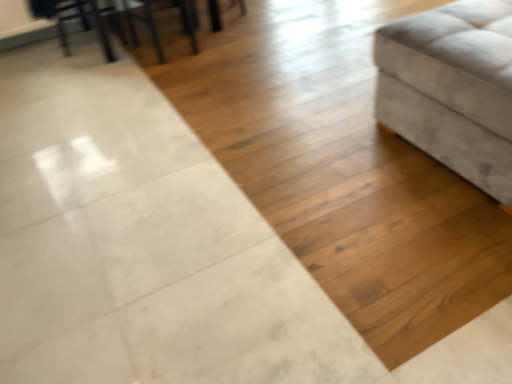
The image size is (512, 384). Describe the element at coordinates (452, 88) in the screenshot. I see `suede-like beige ottoman at right` at that location.

This screenshot has height=384, width=512. Find the location of `suede-like beige ottoman at right`. suede-like beige ottoman at right is located at coordinates (452, 88).

Can you tell me how much suede-like beige ottoman at right and wooden table at upper left differ in facing direction?

There is a 178-degree angle between the facing directions of suede-like beige ottoman at right and wooden table at upper left.

From a real-world perspective, is suede-like beige ottoman at right located beneath wooden table at upper left?

No, from a real-world perspective, suede-like beige ottoman at right is not under wooden table at upper left.

Could wooden table at upper left be considered to be inside suede-like beige ottoman at right?

No.

Does metallic silver swivel chair at upper left have a smaller size compared to metallic black chair at upper left?

Actually, metallic silver swivel chair at upper left might be larger than metallic black chair at upper left.

Could you tell me if metallic silver swivel chair at upper left is facing metallic black chair at upper left?

No, metallic silver swivel chair at upper left is not turned towards metallic black chair at upper left.

In the scene shown: Is metallic silver swivel chair at upper left to the left of metallic black chair at upper left from the viewer's perspective?

Correct, you'll find metallic silver swivel chair at upper left to the left of metallic black chair at upper left.

Is there a large distance between metallic silver swivel chair at upper left and metallic black chair at upper left?

They are positioned close to each other.

Which point is more distant from viewer, (48, 10) or (482, 130)?

The point (48, 10) is behind.

Is metallic silver swivel chair at upper left to the right of suede-like beige ottoman at right from the viewer's perspective?

Incorrect, metallic silver swivel chair at upper left is not on the right side of suede-like beige ottoman at right.

Is metallic silver swivel chair at upper left spatially inside suede-like beige ottoman at right, or outside of it?

metallic silver swivel chair at upper left is spatially situated outside suede-like beige ottoman at right.

Are metallic silver swivel chair at upper left and suede-like beige ottoman at right far apart?

metallic silver swivel chair at upper left is positioned a significant distance from suede-like beige ottoman at right.

Does wooden table at upper left turn towards suede-like beige ottoman at right?

Yes.

Would you consider wooden table at upper left to be distant from suede-like beige ottoman at right?

Yes, wooden table at upper left and suede-like beige ottoman at right are located far from each other.

Measure the distance between wooden table at upper left and suede-like beige ottoman at right.

wooden table at upper left is 6.62 feet away from suede-like beige ottoman at right.

Identify the location of table on the left of suede-like beige ottoman at right. (97, 20).

Which of these two, metallic black chair at upper left or wooden table at upper left, is smaller?

metallic black chair at upper left is smaller.

Is point (193, 42) closer or farther from the camera than point (65, 15)?

Point (193, 42) is closer to the camera than point (65, 15).

Does metallic black chair at upper left have a lesser height compared to wooden table at upper left?

In fact, metallic black chair at upper left may be taller than wooden table at upper left.

Image resolution: width=512 pixels, height=384 pixels. What are the coordinates of `chair that appears below the wooden table at upper left (from the image's perspective)` in the screenshot? It's located at (145, 23).

Would you say metallic silver swivel chair at upper left is part of suede-like beige ottoman at right's contents?

No, metallic silver swivel chair at upper left is located outside of suede-like beige ottoman at right.

Which is more to the right, suede-like beige ottoman at right or metallic silver swivel chair at upper left?

Positioned to the right is suede-like beige ottoman at right.

Can you tell me how much suede-like beige ottoman at right and metallic silver swivel chair at upper left differ in facing direction?

89.6 degrees.

Who is smaller, suede-like beige ottoman at right or metallic silver swivel chair at upper left?

Smaller between the two is metallic silver swivel chair at upper left.

From the picture: Between metallic silver swivel chair at upper left and wooden table at upper left, which one is positioned in front?

Positioned in front is wooden table at upper left.

Can you confirm if metallic silver swivel chair at upper left is wider than wooden table at upper left?

In fact, metallic silver swivel chair at upper left might be narrower than wooden table at upper left.

Is metallic silver swivel chair at upper left positioned with its back to wooden table at upper left?

That's right, metallic silver swivel chair at upper left is facing away from wooden table at upper left.

Locate an element on the screen. The width and height of the screenshot is (512, 384). table located behind the suede-like beige ottoman at right is located at coordinates (97, 20).

Find the location of a particular element. chair located in front of the metallic silver swivel chair at upper left is located at coordinates (145, 23).

From the image, which object appears to be nearer to suede-like beige ottoman at right, metallic black chair at upper left or wooden table at upper left?

Among the two, metallic black chair at upper left is located nearer to suede-like beige ottoman at right.

When comparing their distances from metallic black chair at upper left, does suede-like beige ottoman at right or metallic silver swivel chair at upper left seem closer?

metallic silver swivel chair at upper left is positioned closer to the anchor metallic black chair at upper left.

Considering their positions, is metallic black chair at upper left positioned closer to wooden table at upper left than suede-like beige ottoman at right?

metallic black chair at upper left is positioned closer to the anchor wooden table at upper left.

When comparing their distances from metallic black chair at upper left, does metallic silver swivel chair at upper left or wooden table at upper left seem further?

Among the two, metallic silver swivel chair at upper left is located further to metallic black chair at upper left.

From the image, which object appears to be nearer to metallic silver swivel chair at upper left, suede-like beige ottoman at right or wooden table at upper left?

wooden table at upper left is closer to metallic silver swivel chair at upper left.

Considering their positions, is wooden table at upper left positioned further to metallic silver swivel chair at upper left than metallic black chair at upper left?

metallic black chair at upper left lies further to metallic silver swivel chair at upper left than the other object.

Looking at the image, which one is located further to wooden table at upper left, metallic black chair at upper left or metallic silver swivel chair at upper left?

metallic black chair at upper left.

Which object lies further to the anchor point metallic black chair at upper left, metallic silver swivel chair at upper left or suede-like beige ottoman at right?

suede-like beige ottoman at right lies further to metallic black chair at upper left than the other object.

The image size is (512, 384). Find the location of `chair situated between wooden table at upper left and suede-like beige ottoman at right from left to right`. chair situated between wooden table at upper left and suede-like beige ottoman at right from left to right is located at coordinates (145, 23).

Find the location of a particular element. The height and width of the screenshot is (384, 512). chair between metallic silver swivel chair at upper left and suede-like beige ottoman at right from left to right is located at coordinates (145, 23).

Where is `table between metallic silver swivel chair at upper left and suede-like beige ottoman at right from left to right`? table between metallic silver swivel chair at upper left and suede-like beige ottoman at right from left to right is located at coordinates (97, 20).

The image size is (512, 384). In order to click on table between metallic silver swivel chair at upper left and metallic black chair at upper left in the horizontal direction in this screenshot , I will do `click(97, 20)`.